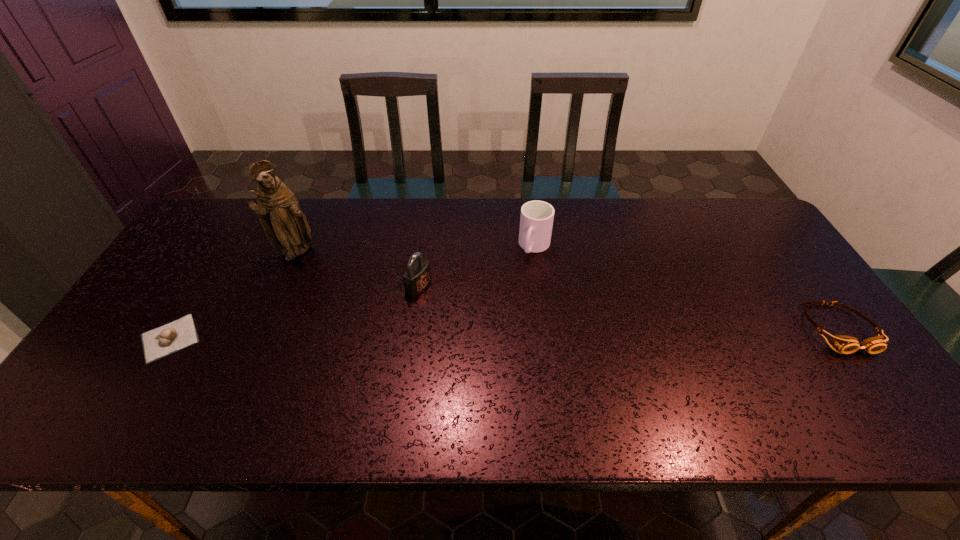
In order to click on the shortest object in this screenshot , I will do `click(157, 343)`.

Where is `the leftmost object`? Image resolution: width=960 pixels, height=540 pixels. the leftmost object is located at coordinates (157, 343).

You are a GUI agent. You are given a task and a screenshot of the screen. Output one action in this format:
    pyautogui.click(x=<x>, y=<y>)
    Task: Click on the fourth tallest object
    This screenshot has height=540, width=960.
    Given the screenshot: What is the action you would take?
    pyautogui.click(x=845, y=344)

This screenshot has width=960, height=540. What are the coordinates of `goggles` in the screenshot? It's located at (845, 344).

Find the location of `padlock`. padlock is located at coordinates (417, 277).

Locate an element on the screen. Image resolution: width=960 pixels, height=540 pixels. the third nearest object is located at coordinates (x=417, y=277).

At what (x,y) coordinates should I click in order to perform the action: click on the fourth object from right to left. Please return your answer as a coordinate pair (x, y). Looking at the image, I should click on (287, 229).

Locate an element on the screen. figurine is located at coordinates (287, 229).

In order to click on the fourth object from left to right in this screenshot , I will do 536,221.

Image resolution: width=960 pixels, height=540 pixels. I want to click on vacant space located 0.280m on the right of the garlic, so click(313, 339).